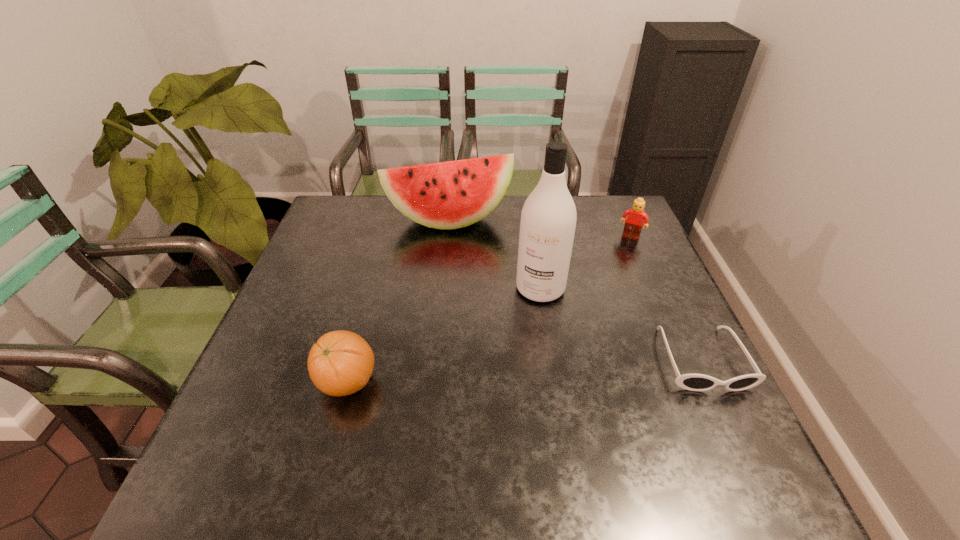
Locate an element on the screen. This screenshot has height=540, width=960. free space on the desktop that is between the orange and the sunglasses and is positioned on the face of the Lego is located at coordinates (575, 367).

At what (x,y) coordinates should I click in order to perform the action: click on vacant space on the desktop that is between the orange and the sunglasses and is positioned on the front-facing side of the shampoo. Please return your answer as a coordinate pair (x, y). Looking at the image, I should click on (498, 372).

Find the location of a particular element. free space on the desktop that is between the orange and the shortest object and is positioned on the outer rind of the second tallest object is located at coordinates (481, 373).